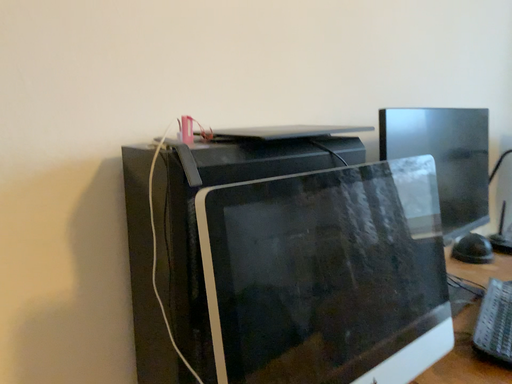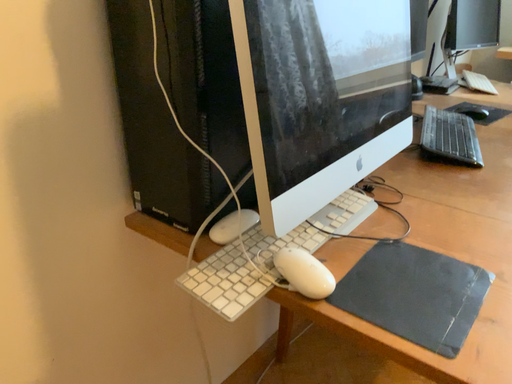
Question: How did the camera likely rotate when shooting the video?

Choices:
 (A) rotated left
 (B) rotated right

Answer: (B)